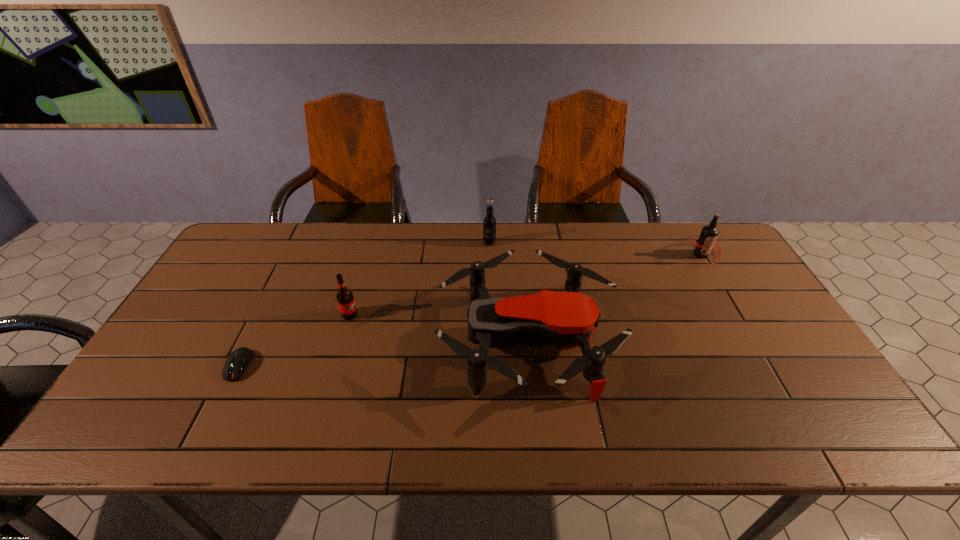
Locate an element on the screen. vacant space located 0.080m on the camera side of the drone is located at coordinates (409, 342).

Locate an element on the screen. The width and height of the screenshot is (960, 540). vacant region located 0.280m on the camera side of the drone is located at coordinates (333, 342).

You are a GUI agent. You are given a task and a screenshot of the screen. Output one action in this format:
    pyautogui.click(x=<x>, y=<y>)
    Task: Click on the vacant area located on the camera side of the drone
    Image resolution: width=960 pixels, height=540 pixels.
    Given the screenshot: What is the action you would take?
    [x=310, y=342]

Where is `free space located 0.130m on the button of the computer equipment`? free space located 0.130m on the button of the computer equipment is located at coordinates pos(206,432).

Where is `object that is at the near edge`? object that is at the near edge is located at coordinates (568, 320).

Where is `object at the right edge`? The image size is (960, 540). object at the right edge is located at coordinates (706, 241).

You are a GUI agent. You are given a task and a screenshot of the screen. Output one action in this format:
    pyautogui.click(x=<x>, y=<y>)
    Task: Click on the object that is at the far right corner
    The width and height of the screenshot is (960, 540).
    Given the screenshot: What is the action you would take?
    pyautogui.click(x=706, y=241)

Locate an element on the screen. The width and height of the screenshot is (960, 540). vacant area at the far edge of the desktop is located at coordinates (600, 238).

This screenshot has width=960, height=540. Find the location of `free point at the near edge`. free point at the near edge is located at coordinates (306, 416).

This screenshot has height=540, width=960. I want to click on free space at the left edge of the desktop, so (x=217, y=350).